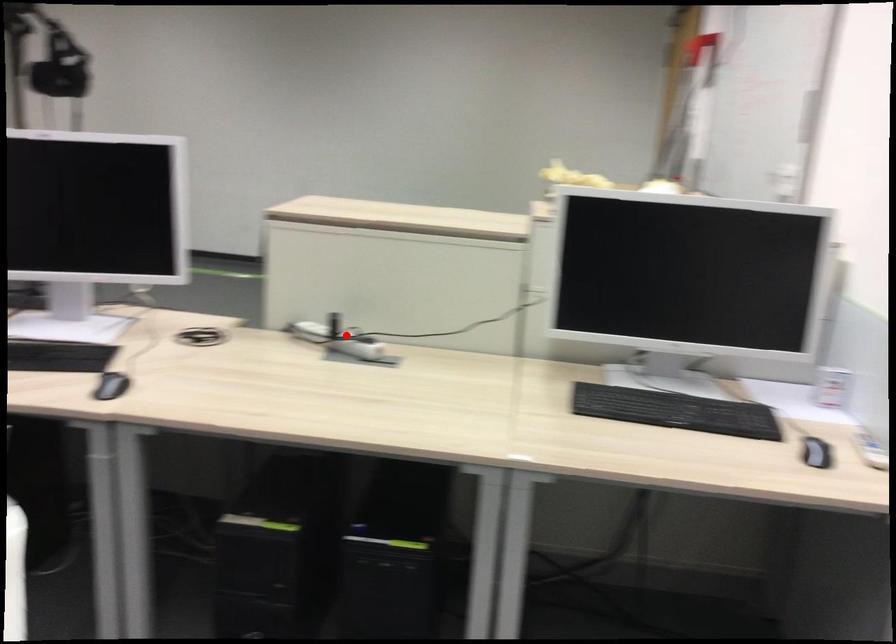
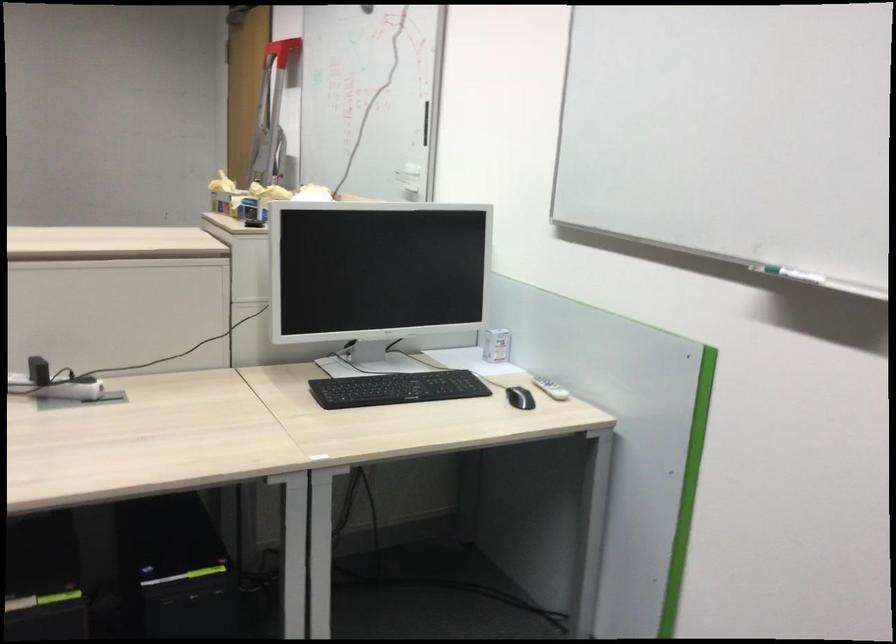
Find the pixel in the second image that matches the highlighted location in the first image.

(53, 383)